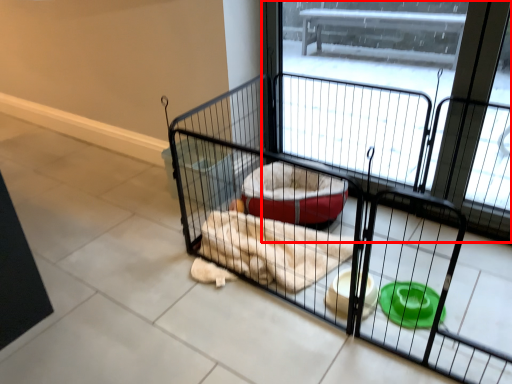
Question: In this image, where is screen door (annotated by the red box) located relative to cage?

Choices:
 (A) right
 (B) left

Answer: (A)